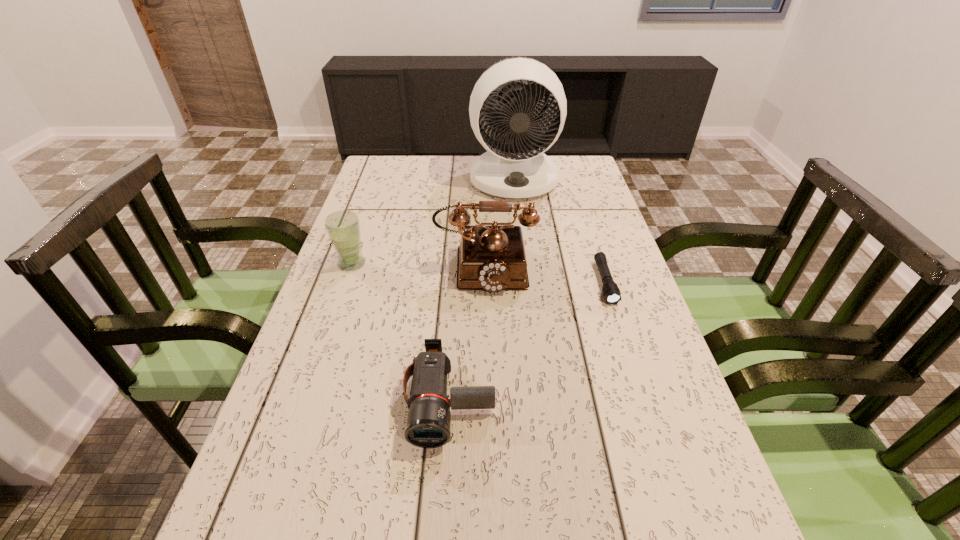
Where is `vacant area situated on the dial of the second tallest object`? This screenshot has width=960, height=540. vacant area situated on the dial of the second tallest object is located at coordinates (486, 384).

The image size is (960, 540). Identify the location of vacant position located 0.230m on the back of the glass. (371, 209).

Identify the location of blank space located on the lens of the nearest object. The height and width of the screenshot is (540, 960). pos(444,489).

The height and width of the screenshot is (540, 960). Identify the location of vacant space located at the lens end of the rightmost object. (653, 431).

Where is `object situated at the far edge`? The height and width of the screenshot is (540, 960). object situated at the far edge is located at coordinates (517, 170).

This screenshot has width=960, height=540. In order to click on object situated at the left edge in this screenshot , I will do `click(343, 227)`.

The height and width of the screenshot is (540, 960). Identify the location of fan that is at the right edge. (517, 170).

Identify the location of flashlight that is at the right edge. The image size is (960, 540). (611, 292).

Where is `object at the far right corner`? The height and width of the screenshot is (540, 960). object at the far right corner is located at coordinates (517, 170).

Locate an element on the screen. The width and height of the screenshot is (960, 540). vacant space at the far edge of the desktop is located at coordinates (470, 164).